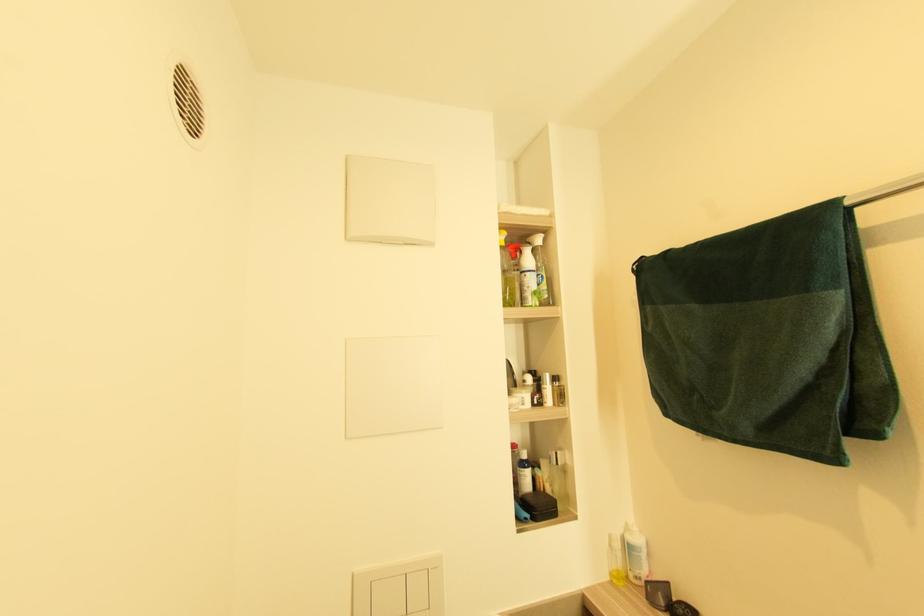
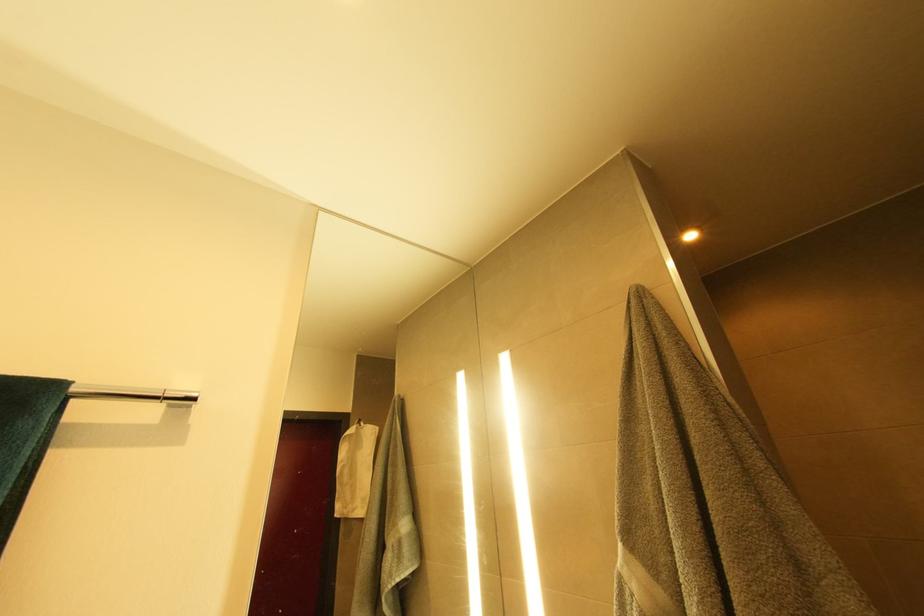
The images are taken continuously from a first-person perspective. In which direction is your viewpoint rotating?

The rotation direction of the camera is right-up.